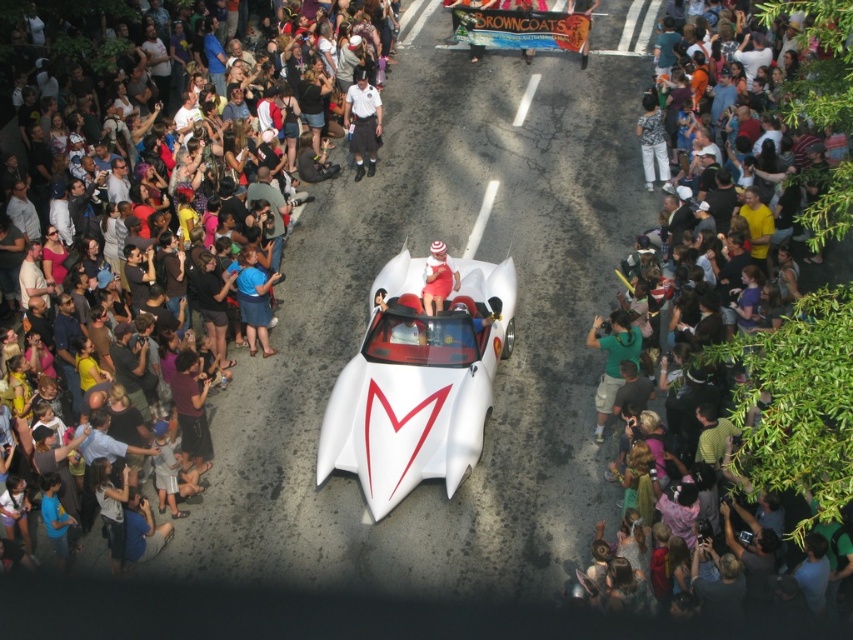
You are a photographer at the event and want to capture both the green fabric shirt at right and the white uniform at center in a single photo. However, you can only focus on one subject at a time. Which subject should you focus on to ensure both are visible in the frame?

The green fabric shirt at right is in front of the white uniform at center, so focusing on the green fabric shirt at right will ensure both are visible in the frame.

You are a photographer trying to capture a clear photo of the white uniform at center. However, the dark clothing crowd at center is blocking your view. Can you move to the left to get a better shot?

The dark clothing crowd at center is positioned under the white uniform at center, so moving to the left might not help as the crowd is below the uniform, not in front of it. You might need to move to a higher position to see above the crowd.